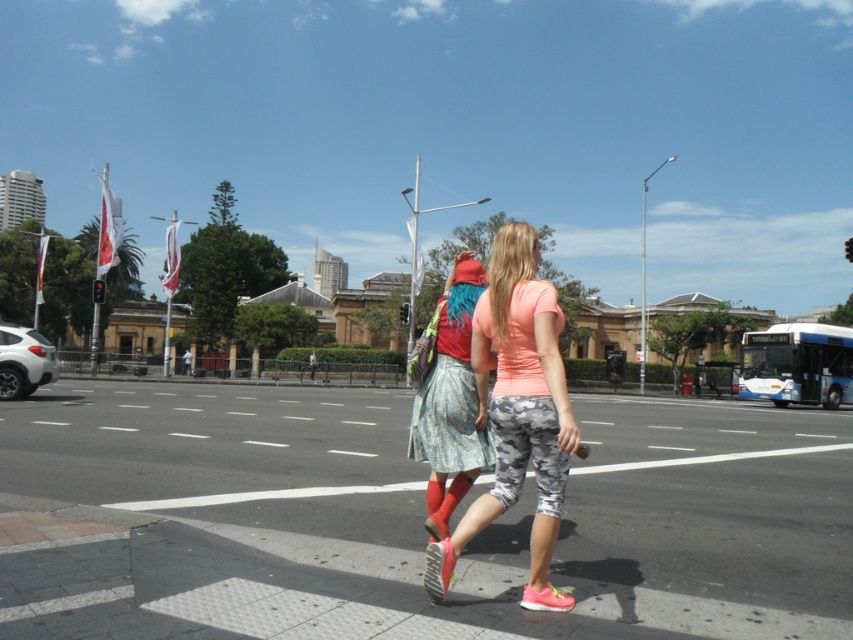
Question: Can you confirm if camouflage leggings at center is smaller than floral skirt at center?

Choices:
 (A) no
 (B) yes

Answer: (A)

Question: Among these objects, which one is farthest from the camera?

Choices:
 (A) floral skirt at center
 (B) camouflage leggings at center

Answer: (A)

Question: Does camouflage leggings at center come behind floral skirt at center?

Choices:
 (A) no
 (B) yes

Answer: (A)

Question: In this image, where is camouflage leggings at center located relative to floral skirt at center?

Choices:
 (A) right
 (B) left

Answer: (A)